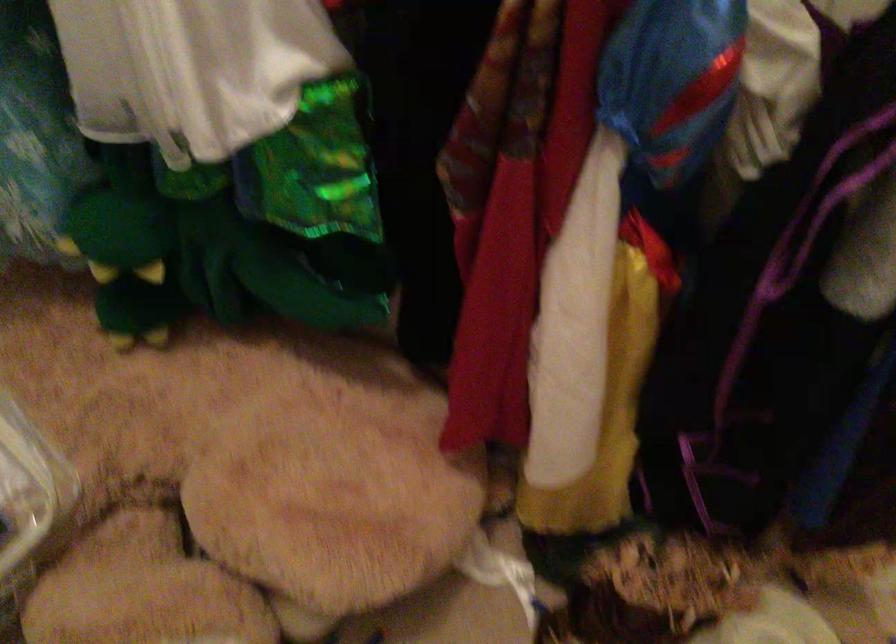
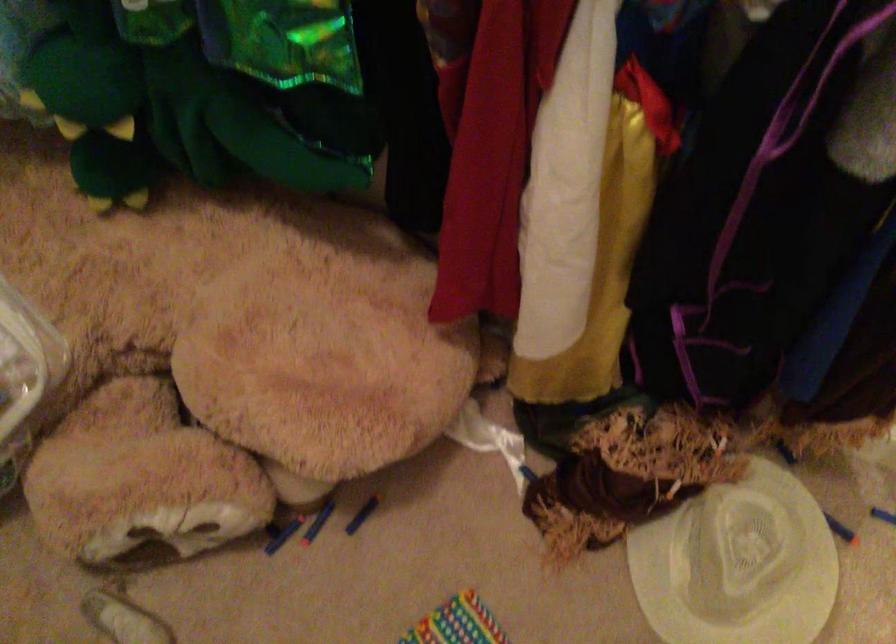
Which direction would the cameraman need to move to produce the second image?

The cameraman walked toward right, forward.